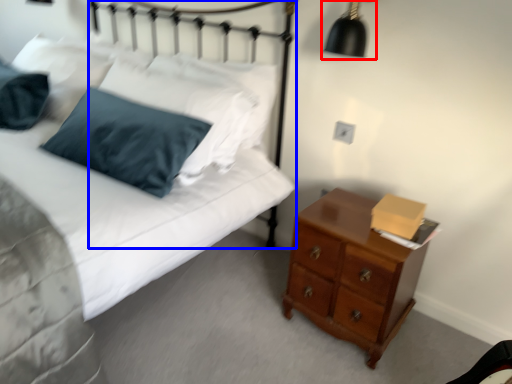
Question: Which of the following is the farthest to the observer, lamp (highlighted by a red box) or headboard (highlighted by a blue box)?

Choices:
 (A) lamp
 (B) headboard

Answer: (B)